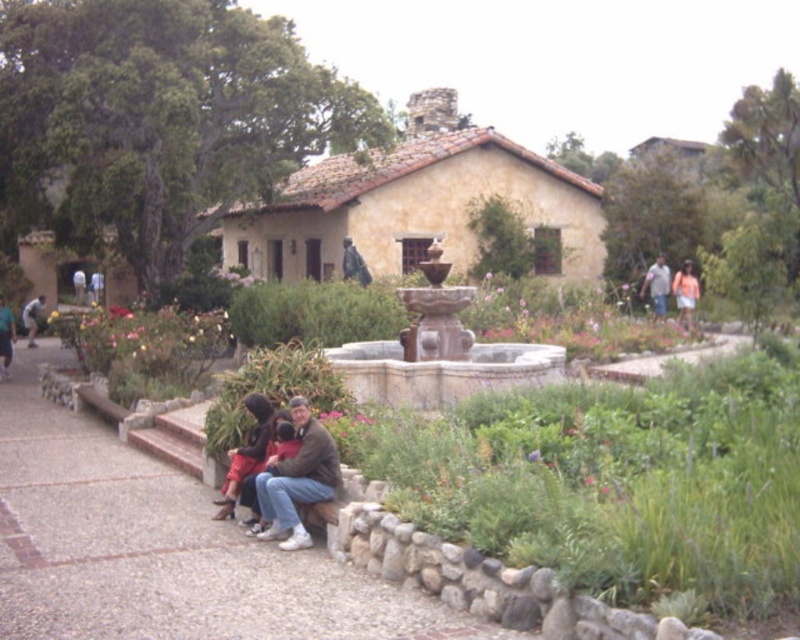
Based on the photo, you are a photographer taking a picture of the family. You notice the matte black jacket at lower center and the denim jacket at right. Which jacket is closer to the camera?

The matte black jacket at lower center is closer to the camera because it is positioned under the denim jacket at right, indicating it is in front.

You are a guest arriving at this Spanish style house and see the smooth concrete bench at lower center and the denim jacket at right. Which object is bigger in size?

The smooth concrete bench at lower center is larger in size than the denim jacket at right.